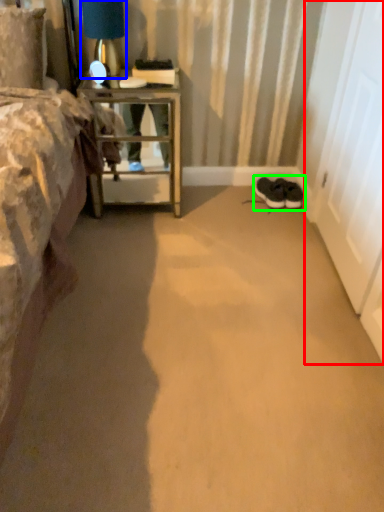
Question: Which object is positioned closest to screen door (highlighted by a red box)? Select from table lamp (highlighted by a blue box) and footwear (highlighted by a green box).

Choices:
 (A) table lamp
 (B) footwear

Answer: (B)